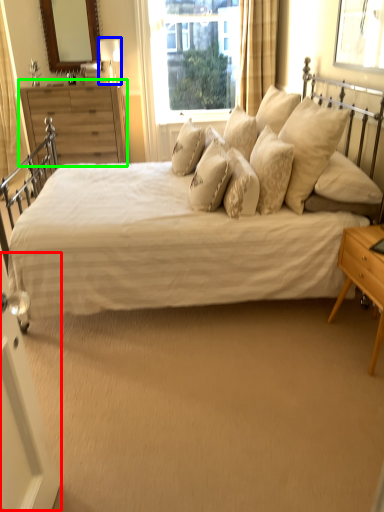
Question: Based on their relative distances, which object is farther from screen door (highlighted by a red box)? Choose from table lamp (highlighted by a blue box) and chest of drawers (highlighted by a green box).

Choices:
 (A) table lamp
 (B) chest of drawers

Answer: (A)